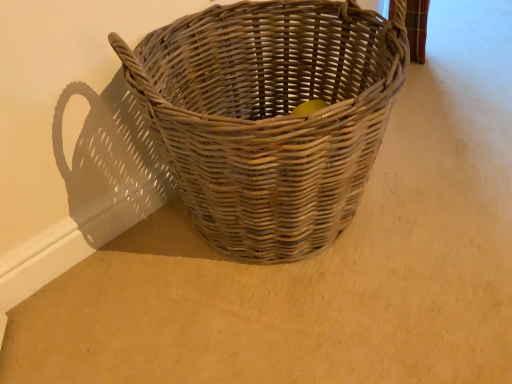
You are a GUI agent. You are given a task and a screenshot of the screen. Output one action in this format:
    pyautogui.click(x=<x>, y=<y>)
    Task: Click on the vacant region in front of natural wicker basket at center
    
    Given the screenshot: What is the action you would take?
    click(316, 328)